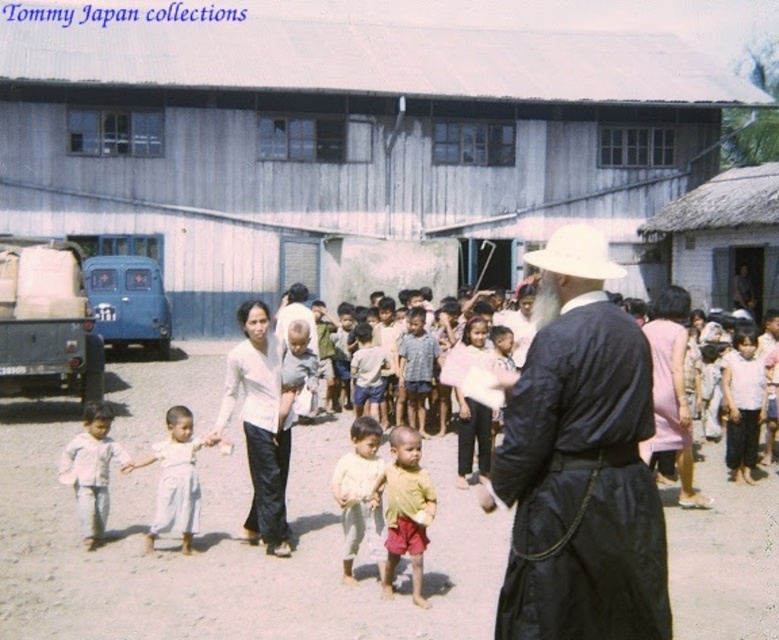
You are organizing a small parade for the community event and need to place a starting line marker. The light pink fabric at lower left will mark the start, and the white matte cowboy hat at center will be the finish line. If your parade route must be at least 5 meters long, will this placement work?

The distance between the light pink fabric at lower left and the white matte cowboy hat at center is 5.11 meters, which meets the minimum requirement of 5 meters. Therefore, this placement will work for the parade route.

You are standing at the entrance of the gathering area and want to find the white cotton shirt at center. According to the coordinates provided, in which direction should you move relative to your current position?

The white cotton shirt at center is located at coordinates point (x=259, y=426). Since the coordinate system typically places (x=0, y=0) at the bottom left corner, moving towards the upper right direction from the entrance would lead you to the white cotton shirt at center.

In the scene described, where is the light pink fabric at lower left located in terms of coordinates?

The light pink fabric at lower left is located at coordinates point (90,468).